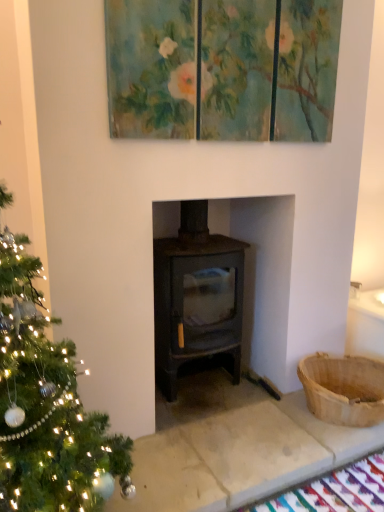
Image resolution: width=384 pixels, height=512 pixels. What do you see at coordinates (222, 69) in the screenshot?
I see `teal textured triptych at upper center` at bounding box center [222, 69].

Identify the location of matte black stove at center. (262, 275).

Locate an element on the screen. Image resolution: width=384 pixels, height=512 pixels. teal textured triptych at upper center is located at coordinates (222, 69).

From a real-world perspective, is teal textured triptych at upper center located beneath brown woven basket at right?

Actually, teal textured triptych at upper center is physically above brown woven basket at right in the real world.

Are teal textured triptych at upper center and brown woven basket at right located far from each other?

Yes, teal textured triptych at upper center and brown woven basket at right are located far from each other.

Is teal textured triptych at upper center bigger than brown woven basket at right?

Yes.

From the picture: Is brown woven basket at right inside or outside of teal textured triptych at upper center?

brown woven basket at right is located beyond the bounds of teal textured triptych at upper center.

Is brown woven basket at right wider or thinner than teal textured triptych at upper center?

brown woven basket at right is wider than teal textured triptych at upper center.

Would you say brown woven basket at right is a long distance from teal textured triptych at upper center?

Yes.

Looking at this image, considering the relative positions of brown woven basket at right and teal textured triptych at upper center in the image provided, is brown woven basket at right to the right of teal textured triptych at upper center from the viewer's perspective?

Correct, you'll find brown woven basket at right to the right of teal textured triptych at upper center.

Based on the photo, from the image's perspective, which is below, matte black stove at center or teal textured triptych at upper center?

matte black stove at center is shown below in the image.

Is matte black stove at center to the left or to the right of teal textured triptych at upper center in the image?

matte black stove at center is positioned on teal textured triptych at upper center's left side.

Is matte black stove at center positioned far away from teal textured triptych at upper center?

No, matte black stove at center is not far from teal textured triptych at upper center.

Does brown woven basket at right have a smaller size compared to matte black stove at center?

Indeed, brown woven basket at right has a smaller size compared to matte black stove at center.

Is brown woven basket at right thinner than matte black stove at center?

Correct, the width of brown woven basket at right is less than that of matte black stove at center.

Is brown woven basket at right surrounding matte black stove at center?

No, matte black stove at center is located outside of brown woven basket at right.

Measure the distance from brown woven basket at right to matte black stove at center.

They are 16.37 inches apart.

Considering the sizes of objects matte black stove at center and brown woven basket at right in the image provided, who is bigger, matte black stove at center or brown woven basket at right?

With larger size is matte black stove at center.

Do you think matte black stove at center is within brown woven basket at right, or outside of it?

matte black stove at center lies outside brown woven basket at right.

Is the surface of matte black stove at center in direct contact with brown woven basket at right?

No, matte black stove at center is not in contact with brown woven basket at right.

Does matte black stove at center turn towards brown woven basket at right?

No.

Relative to matte black stove at center, is teal textured triptych at upper center in front or behind?

teal textured triptych at upper center is in front of matte black stove at center.

In terms of height, does teal textured triptych at upper center look taller or shorter compared to matte black stove at center?

In the image, teal textured triptych at upper center appears to be shorter than matte black stove at center.

Is teal textured triptych at upper center wider or thinner than matte black stove at center?

In the image, teal textured triptych at upper center appears to be more narrow than matte black stove at center.

From a real-world perspective, between teal textured triptych at upper center and matte black stove at center, who is vertically higher?

teal textured triptych at upper center, from a real-world perspective.

This screenshot has width=384, height=512. Identify the location of basket below the teal textured triptych at upper center (from a real-world perspective). (343, 389).

Locate an element on the screen. Image resolution: width=384 pixels, height=512 pixels. basket behind the teal textured triptych at upper center is located at coordinates (343, 389).

When comparing their distances from brown woven basket at right, does matte black stove at center or teal textured triptych at upper center seem further?

Among the two, teal textured triptych at upper center is located further to brown woven basket at right.

Which object lies further to the anchor point teal textured triptych at upper center, brown woven basket at right or matte black stove at center?

brown woven basket at right lies further to teal textured triptych at upper center than the other object.

From the image, which object appears to be farther from teal textured triptych at upper center, matte black stove at center or brown woven basket at right?

brown woven basket at right is further to teal textured triptych at upper center.

Looking at the image, which one is located closer to matte black stove at center, teal textured triptych at upper center or brown woven basket at right?

brown woven basket at right lies closer to matte black stove at center than the other object.

When comparing their distances from brown woven basket at right, does teal textured triptych at upper center or matte black stove at center seem closer?

matte black stove at center is closer to brown woven basket at right.

Based on their spatial positions, is brown woven basket at right or teal textured triptych at upper center closer to matte black stove at center?

brown woven basket at right is positioned closer to the anchor matte black stove at center.

At what (x,y) coordinates should I click in order to perform the action: click on fireplace that lies between teal textured triptych at upper center and brown woven basket at right from top to bottom. Please return your answer as a coordinate pair (x, y). The width and height of the screenshot is (384, 512). Looking at the image, I should click on (262, 275).